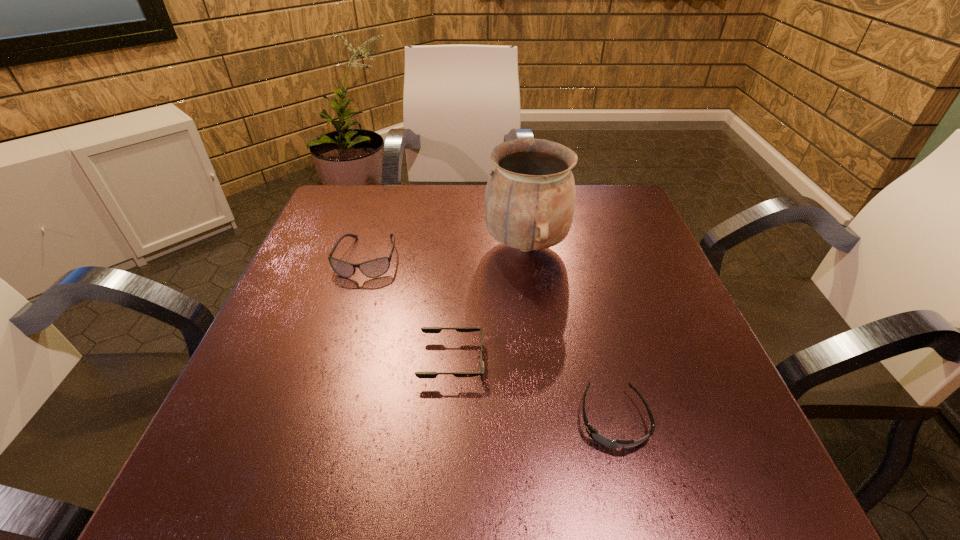
Where is `vacant point located between the nearest sunglasses and the leftmost object`? Image resolution: width=960 pixels, height=540 pixels. vacant point located between the nearest sunglasses and the leftmost object is located at coordinates (490, 339).

Where is `vacant point located between the nearest object and the second nearest object`? This screenshot has width=960, height=540. vacant point located between the nearest object and the second nearest object is located at coordinates (533, 390).

The image size is (960, 540). I want to click on unoccupied position between the second nearest sunglasses and the second tallest object, so click(409, 309).

Identify which object is located as the second nearest to the farthest sunglasses. Please provide its 2D coordinates. Your answer should be formatted as a tuple, i.e. [(x, y)], where the tuple contains the x and y coordinates of a point satisfying the conditions above.

[(529, 203)]

Locate an element on the screen. the closest object to the rightmost sunglasses is located at coordinates (424, 329).

In order to click on sunglasses that stands as the second closest to the second nearest object in this screenshot , I will do `click(375, 268)`.

Find the location of a particular element. This screenshot has width=960, height=540. sunglasses that is the nearest to the farthest sunglasses is located at coordinates (424, 329).